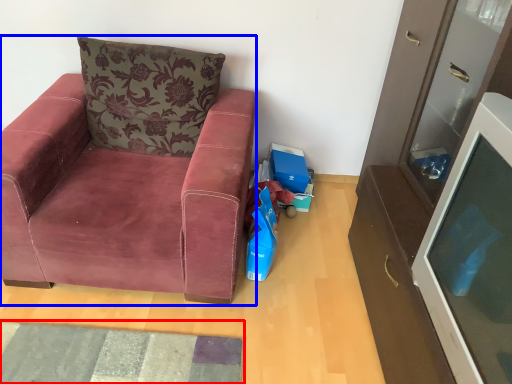
Question: Which of the following is the farthest to the observer, mat (highlighted by a red box) or chair (highlighted by a blue box)?

Choices:
 (A) mat
 (B) chair

Answer: (A)